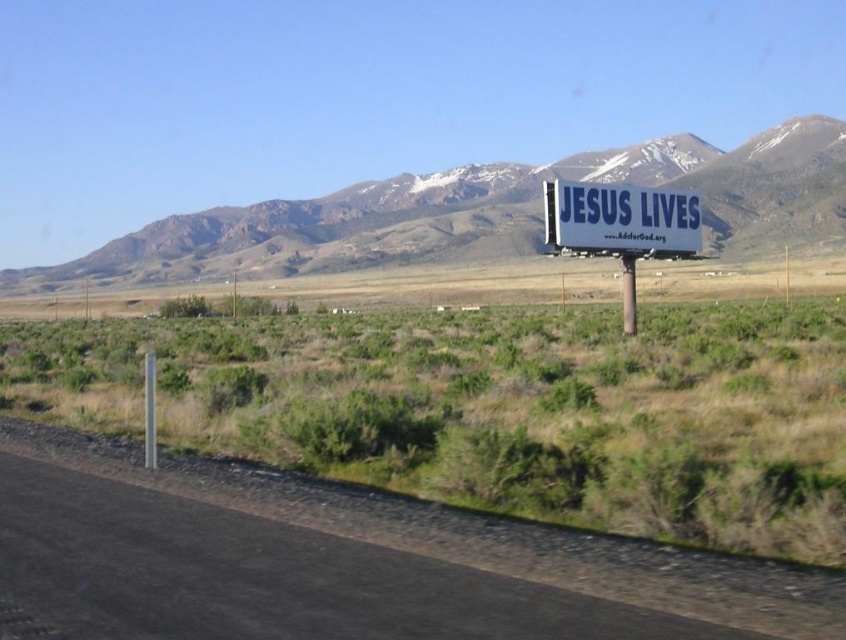
Is rocky brown mountain range at upper center further to the viewer compared to white plastic billboard at center-right?

Yes, rocky brown mountain range at upper center is behind white plastic billboard at center-right.

Between rocky brown mountain range at upper center and white plastic billboard at center-right, which one appears on the right side from the viewer's perspective?

From the viewer's perspective, white plastic billboard at center-right appears more on the right side.

Between point (501, 166) and point (641, 211), which one is positioned behind?

The point (501, 166) is more distant.

Locate an element on the screen. The height and width of the screenshot is (640, 846). rocky brown mountain range at upper center is located at coordinates (479, 212).

Which is behind, point (756, 189) or point (630, 320)?

Point (756, 189)

Who is higher up, rocky brown mountain range at upper center or white plastic pole at center-right?

rocky brown mountain range at upper center

I want to click on rocky brown mountain range at upper center, so click(x=479, y=212).

Consider the image. Who is positioned more to the left, white plastic billboard at center-right or metallic pole at center-left?

metallic pole at center-left

Does point (651, 250) come in front of point (144, 356)?

No, (651, 250) is behind (144, 356).

Between point (553, 253) and point (146, 369), which one is positioned behind?

Positioned behind is point (553, 253).

Identify the location of white plastic billboard at center-right. This screenshot has width=846, height=640. (619, 227).